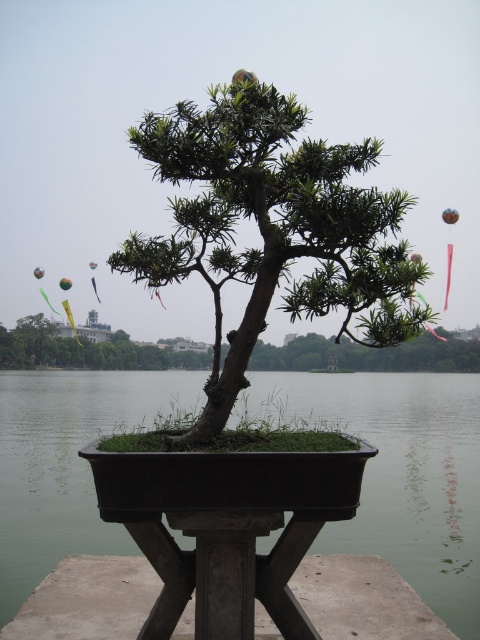
Question: Where is green concrete water at center located in relation to green matte bonsai at center in the image?

Choices:
 (A) below
 (B) above

Answer: (A)

Question: Considering the real-world distances, which object is farthest from the green matte bonsai at center?

Choices:
 (A) green matte bonsai tree at center
 (B) green concrete water at center

Answer: (A)

Question: Is green matte bonsai at center wider than green matte bonsai tree at center?

Choices:
 (A) no
 (B) yes

Answer: (A)

Question: Which object is the closest to the green matte bonsai tree at center?

Choices:
 (A) green concrete water at center
 (B) green matte bonsai at center

Answer: (A)

Question: Is the position of green concrete water at center more distant than that of green matte bonsai at center?

Choices:
 (A) no
 (B) yes

Answer: (B)

Question: Estimate the real-world distances between objects in this image. Which object is closer to the green concrete water at center?

Choices:
 (A) green matte bonsai at center
 (B) green matte bonsai tree at center

Answer: (B)